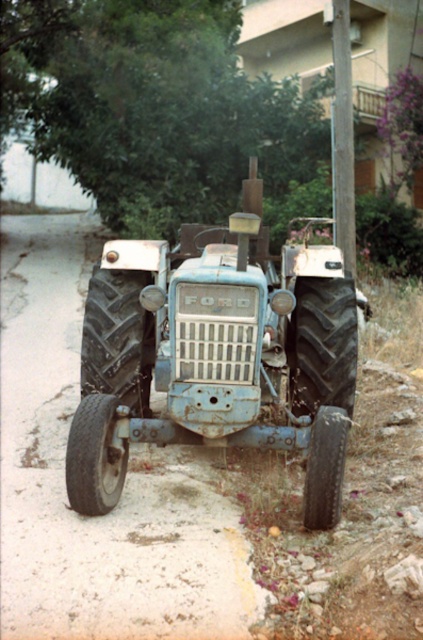
Between rusty blue tractor at center and smooth wooden pole at upper center, which one is positioned higher?

Positioned higher is smooth wooden pole at upper center.

Image resolution: width=423 pixels, height=640 pixels. What are the coordinates of `rusty blue tractor at center` in the screenshot? It's located at (216, 355).

Where is `rusty blue tractor at center`? rusty blue tractor at center is located at coordinates (216, 355).